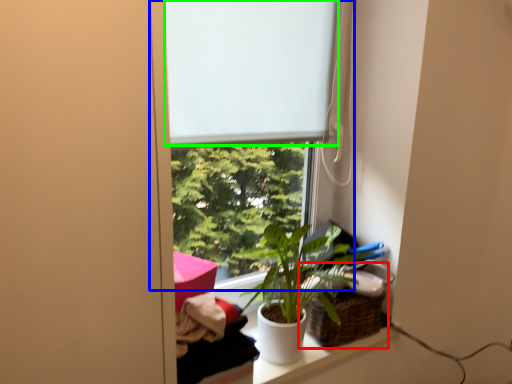
Question: Which is nearer to the basket (highlighted by a red box)? window (highlighted by a blue box) or window screen (highlighted by a green box).

Choices:
 (A) window
 (B) window screen

Answer: (A)